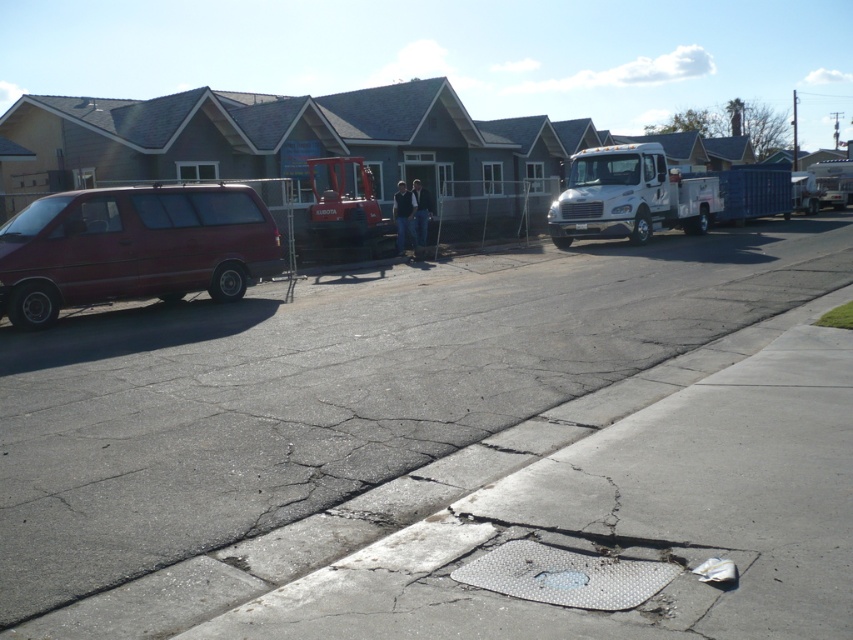
In the scene shown: Does matte red van at left have a larger size compared to white metallic truck at center?

No.

Between point (19, 246) and point (608, 209), which one is positioned behind?

Point (608, 209)

In order to click on matte red van at left in this screenshot , I will do `click(132, 248)`.